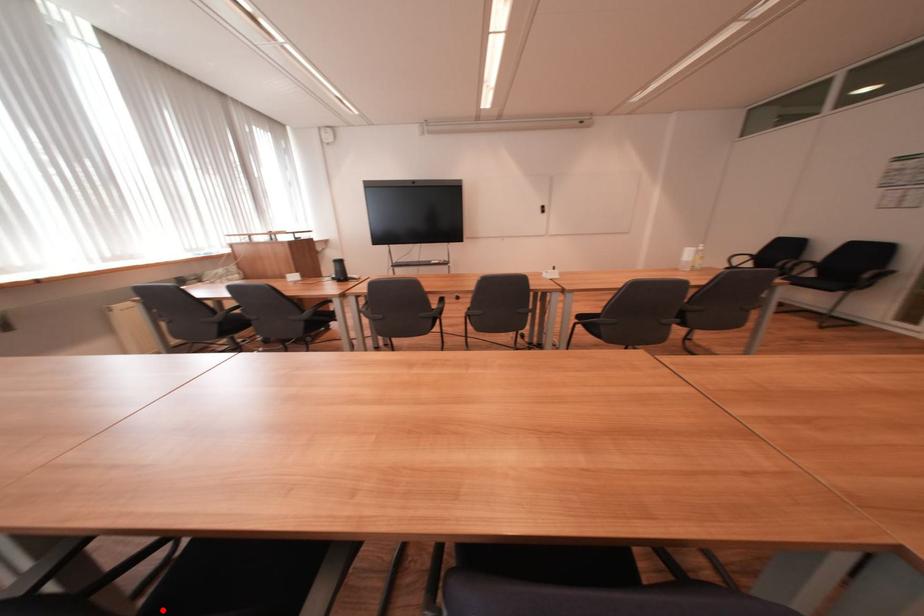
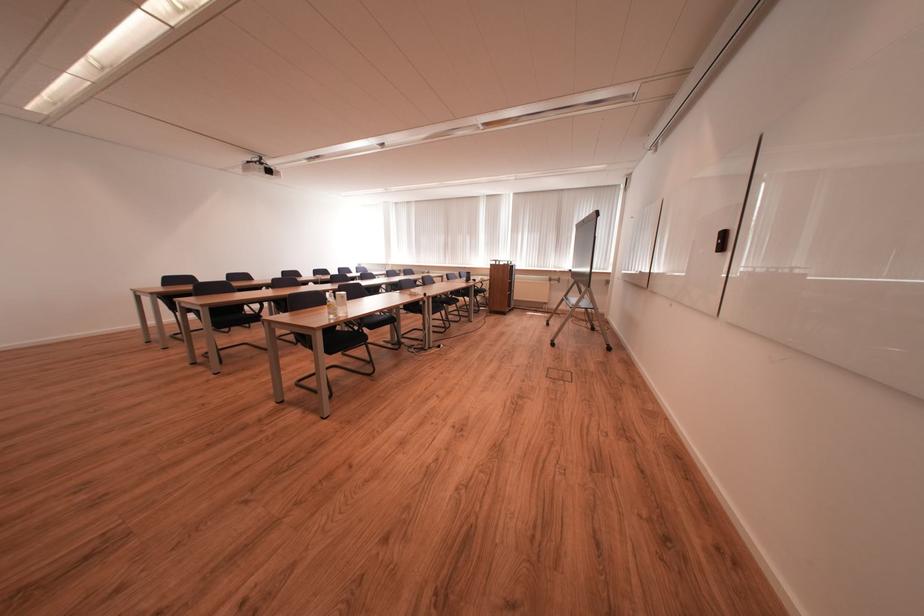
Question: I am providing you with two images of the same scene from different viewpoints. A red point is marked on the first image. Is the red point's position out of view in image 2?

Choices:
 (A) Yes
 (B) No

Answer: (A)